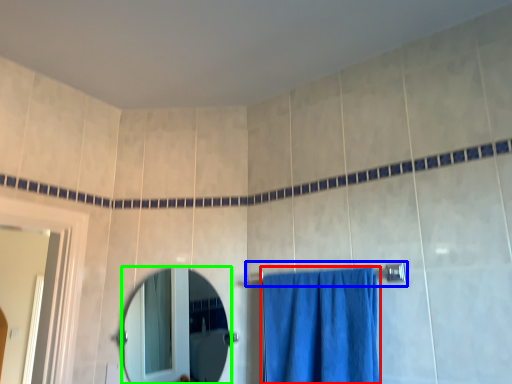
Question: Which is nearer to the curtain (highlighted by a red box)? towel bar (highlighted by a blue box) or mirror (highlighted by a green box).

Choices:
 (A) towel bar
 (B) mirror

Answer: (A)